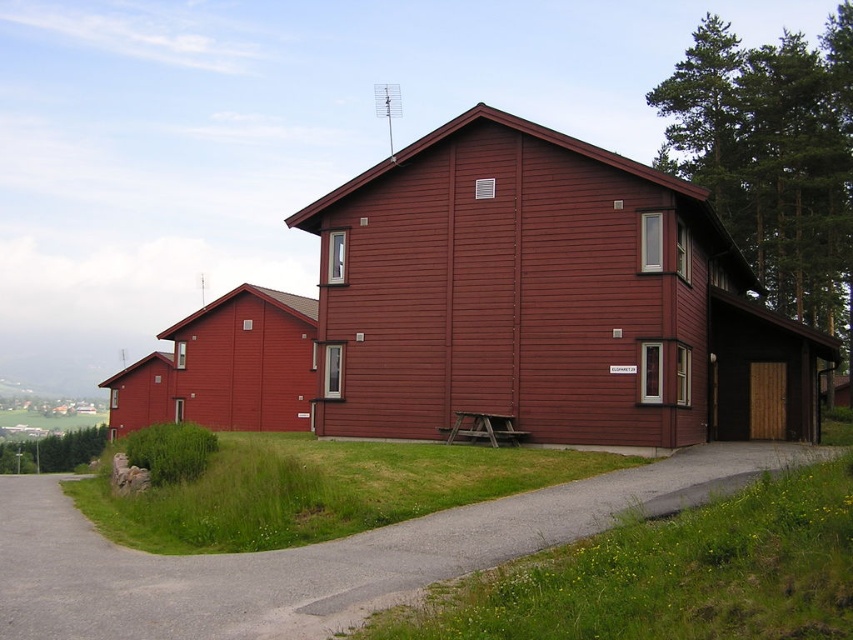
Question: Observing the image, what is the correct spatial positioning of matte wood barn at center in reference to gray asphalt driveway at lower left?

Choices:
 (A) left
 (B) right

Answer: (B)

Question: Does matte wood barn at center appear under gray asphalt driveway at lower left?

Choices:
 (A) yes
 (B) no

Answer: (B)

Question: Which of the following is the farthest from the observer?

Choices:
 (A) (82, 611)
 (B) (637, 221)

Answer: (B)

Question: Does matte wood barn at center appear under gray asphalt driveway at lower left?

Choices:
 (A) yes
 (B) no

Answer: (B)

Question: Which point is farther to the camera?

Choices:
 (A) (223, 637)
 (B) (612, 164)

Answer: (B)